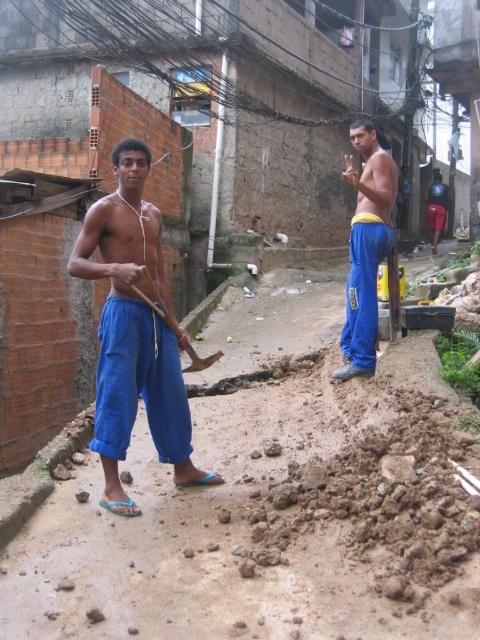
Is point (73, 260) more distant than point (380, 150)?

No, (73, 260) is in front of (380, 150).

Does blue cotton pants at left have a smaller size compared to blue cotton pants at center?

No, blue cotton pants at left is not smaller than blue cotton pants at center.

Which is behind, point (135, 156) or point (374, 362)?

Positioned behind is point (374, 362).

Find the location of `blue cotton pants at left`. blue cotton pants at left is located at coordinates (133, 332).

Is blue cotton pants at center in front of wooden handle shovel at center?

No, blue cotton pants at center is behind wooden handle shovel at center.

Does point (375, 134) come farther from viewer compared to point (165, 305)?

Yes, it is.

Is point (376, 182) more distant than point (189, 355)?

That is True.

What are the coordinates of `blue cotton pants at center` in the screenshot? It's located at (365, 248).

Is blue cotton pants at left wider than wooden handle shovel at center?

Yes, blue cotton pants at left is wider than wooden handle shovel at center.

Does point (156, 330) come closer to viewer compared to point (194, 355)?

Yes, point (156, 330) is in front of point (194, 355).

Is point (155, 216) positioned behind point (156, 292)?

Yes, it is behind point (156, 292).

This screenshot has width=480, height=640. What are the coordinates of `blue cotton pants at left` in the screenshot? It's located at (133, 332).